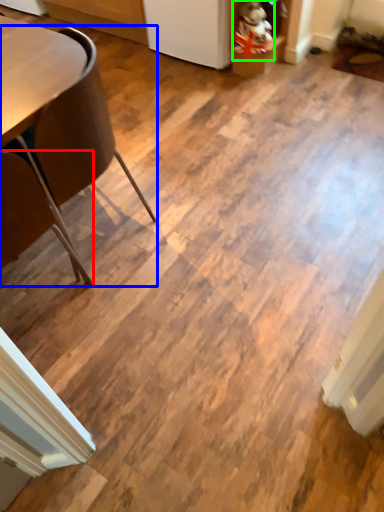
Question: Which object is the closest to the chair (highlighted by a red box)? Choose among these: chair (highlighted by a blue box) or toy (highlighted by a green box).

Choices:
 (A) chair
 (B) toy

Answer: (A)